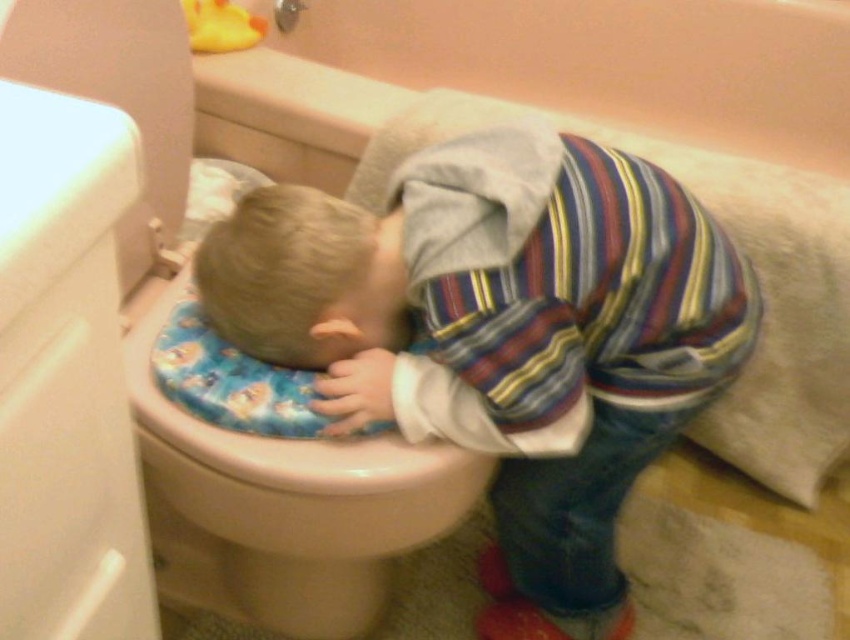
Question: Can you confirm if striped fabric shirt at center is positioned to the right of blonde hair at center?

Choices:
 (A) yes
 (B) no

Answer: (A)

Question: Among these objects, which one is farthest from the camera?

Choices:
 (A) white glossy toilet at left
 (B) blonde hair at center
 (C) striped fabric shirt at center

Answer: (B)

Question: Which object is the farthest from the blonde hair at center?

Choices:
 (A) white glossy toilet at left
 (B) striped fabric shirt at center

Answer: (A)

Question: Is striped fabric shirt at center bigger than white glossy toilet at left?

Choices:
 (A) no
 (B) yes

Answer: (A)

Question: Can you confirm if white glossy toilet at left is thinner than blonde hair at center?

Choices:
 (A) no
 (B) yes

Answer: (A)

Question: Which point is closer to the camera?

Choices:
 (A) white glossy toilet at left
 (B) striped fabric shirt at center

Answer: (A)